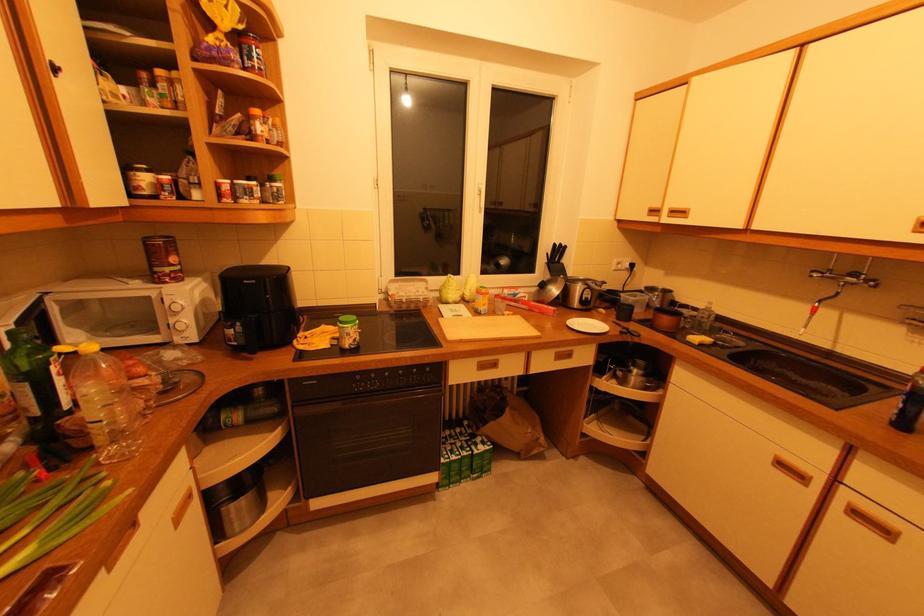
The image size is (924, 616). Identify the location of faucet spray head. (859, 277).